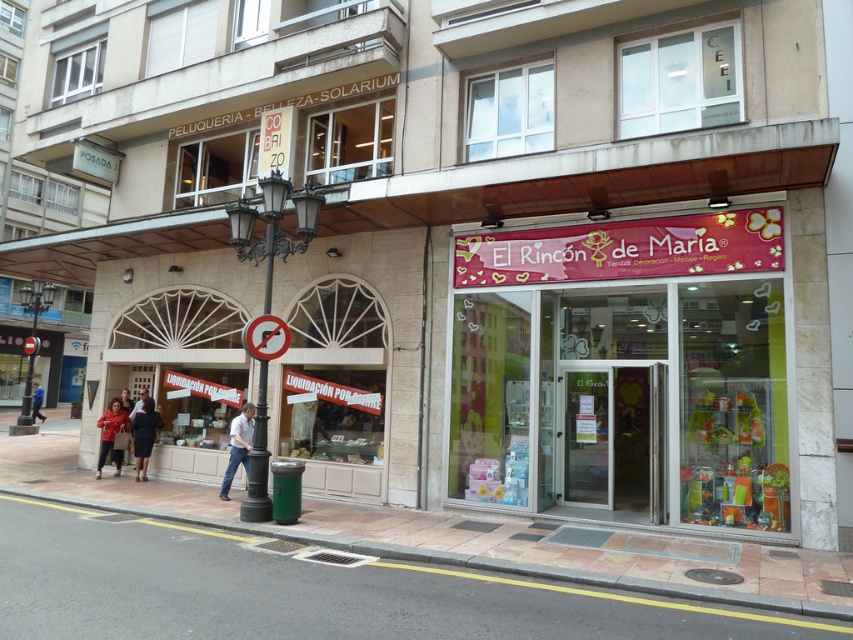
You are standing at the entrance of the store with the sign that reads El Rinc?n de Mar?a. You want to walk to the smooth concrete pavement at lower center. Which direction should you move?

You should move downward from the store entrance towards the smooth concrete pavement at lower center located at point (306, 592).

You are standing on the smooth concrete pavement at lower center and want to move towards the dark blue fabric coat at center. Which direction should you move to reach it?

You should move to the left to reach the dark blue fabric coat at center since the smooth concrete pavement at lower center is to the right of it.